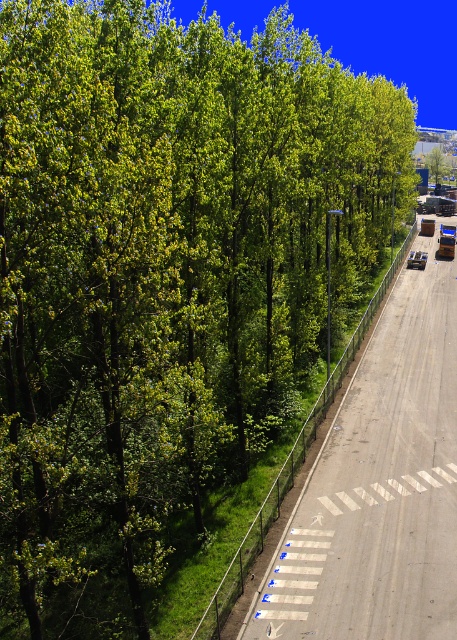
Question: Which object is closer to the camera taking this photo?

Choices:
 (A) green leafy tree at center
 (B) asphalt road at center

Answer: (B)

Question: Which point is farther to the camera?

Choices:
 (A) green leafy tree at center
 (B) asphalt road at center

Answer: (A)

Question: Does asphalt road at center lie behind green leafy tree at center?

Choices:
 (A) yes
 (B) no

Answer: (B)

Question: Does asphalt road at center have a greater width compared to green leafy tree at center?

Choices:
 (A) yes
 (B) no

Answer: (A)

Question: Which point is closer to the camera?

Choices:
 (A) (431, 148)
 (B) (419, 310)

Answer: (B)

Question: Does asphalt road at center appear under green leafy tree at center?

Choices:
 (A) yes
 (B) no

Answer: (A)